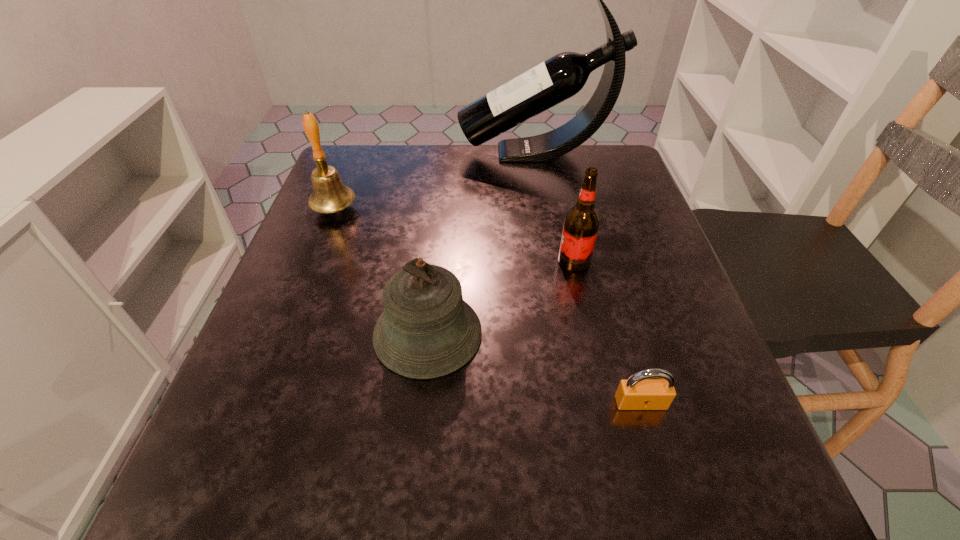
Image resolution: width=960 pixels, height=540 pixels. Identify the location of vacant area that lies between the shortest object and the left bell. (488, 306).

Point out which object is positioned as the nearest to the third nearest object. Please provide its 2D coordinates. Your answer should be formatted as a tuple, i.e. [(x, y)], where the tuple contains the x and y coordinates of a point satisfying the conditions above.

[(427, 330)]

I want to click on object that is the fourth closest one to the tallest object, so click(639, 392).

Find the location of `vacant region that satisfies the following two spatial constraints: 1. on the stand of the tallest object; 2. on the back side of the third farthest object`. vacant region that satisfies the following two spatial constraints: 1. on the stand of the tallest object; 2. on the back side of the third farthest object is located at coordinates (554, 261).

Identify the location of free spot that satisfies the following two spatial constraints: 1. on the stand of the root beer; 2. on the left side of the tallest object. The width and height of the screenshot is (960, 540). (554, 261).

The image size is (960, 540). I want to click on free point that satisfies the following two spatial constraints: 1. on the back side of the second shortest object; 2. on the right side of the root beer, so click(x=435, y=261).

What are the coordinates of `free location that satisfies the following two spatial constraints: 1. on the back side of the root beer; 2. on the right side of the second shortest object` in the screenshot? It's located at (435, 261).